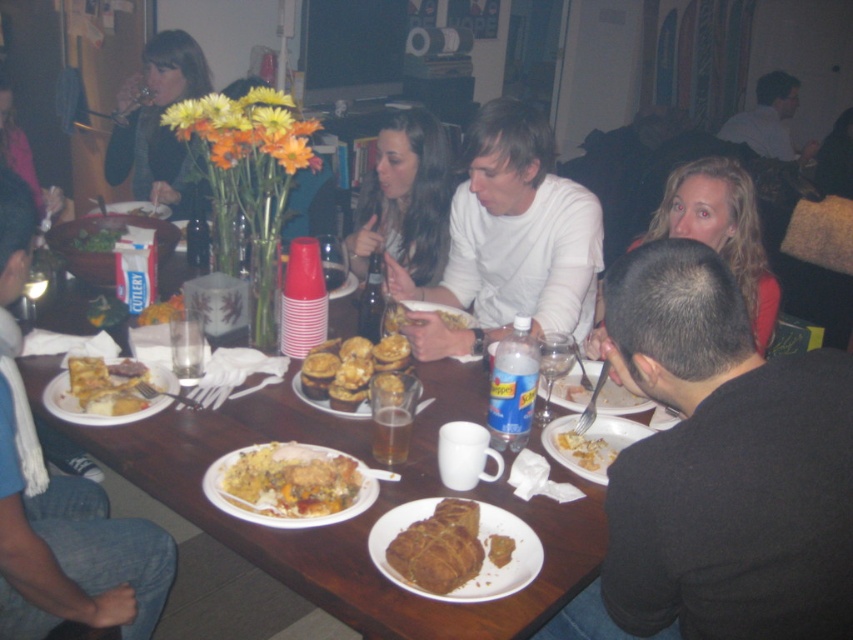
Question: Which object is positioned closest to the matte black jacket at upper left?

Choices:
 (A) golden brown muffins at center
 (B) green leafy vegetable at center

Answer: (B)

Question: Does matte black sweater at upper left have a greater width compared to white matte shirt at upper center?

Choices:
 (A) no
 (B) yes

Answer: (A)

Question: Is blonde hair at upper right further to camera compared to yellow matte scrambled eggs at lower center?

Choices:
 (A) yes
 (B) no

Answer: (A)

Question: Which point is farther from the camera taking this photo?

Choices:
 (A) tap(111, 211)
 (B) tap(589, 461)
 (C) tap(489, 547)
 (D) tap(355, 396)

Answer: (A)

Question: Which object is farther from the camera taking this photo?

Choices:
 (A) yellow matte scrambled eggs at lower center
 (B) smooth white shirt at center

Answer: (B)

Question: Can you confirm if white matte plate at lower right is thinner than matte white plate at center?

Choices:
 (A) yes
 (B) no

Answer: (A)